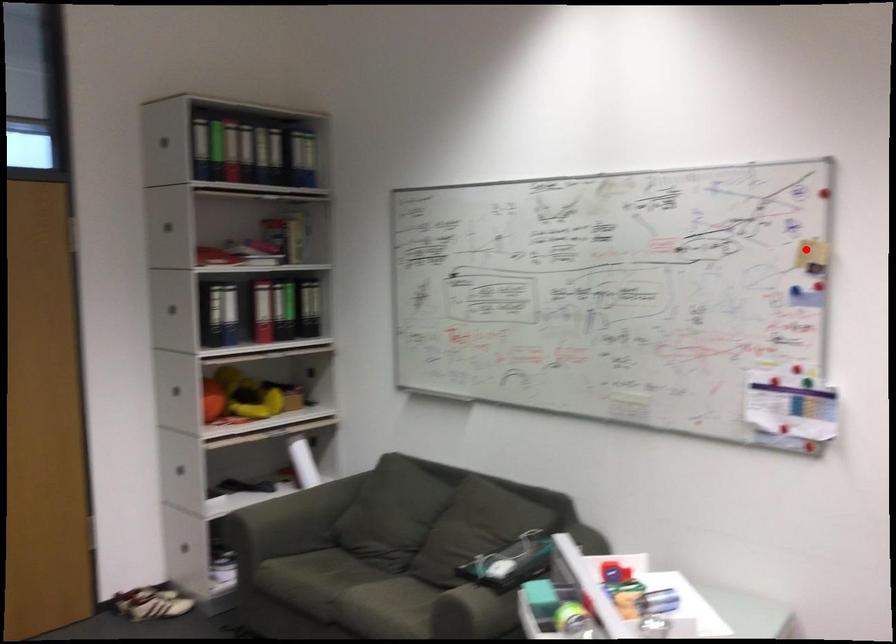
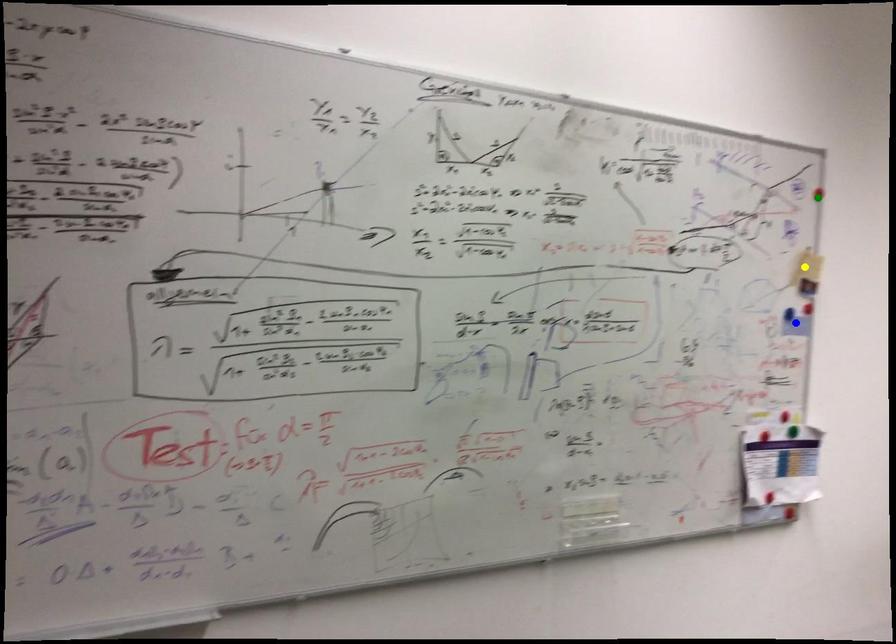
Question: I am providing you with two images of the same scene from different viewpoints. A red point is marked on the first image. You are given multiple points on the second image. Which point in image 2 is actually the same real-world point as the red point in image 1?

Choices:
 (A) yellow point
 (B) green point
 (C) blue point

Answer: (A)